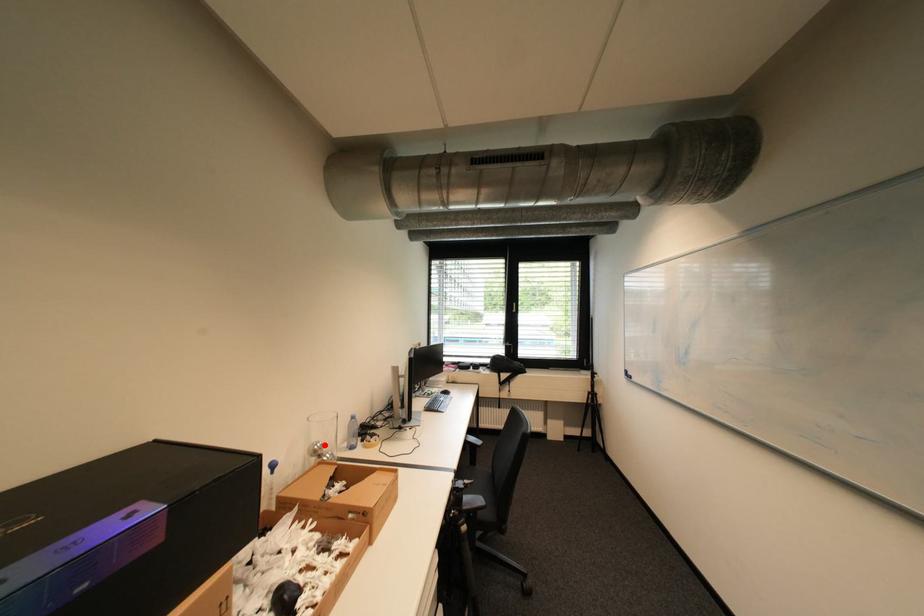
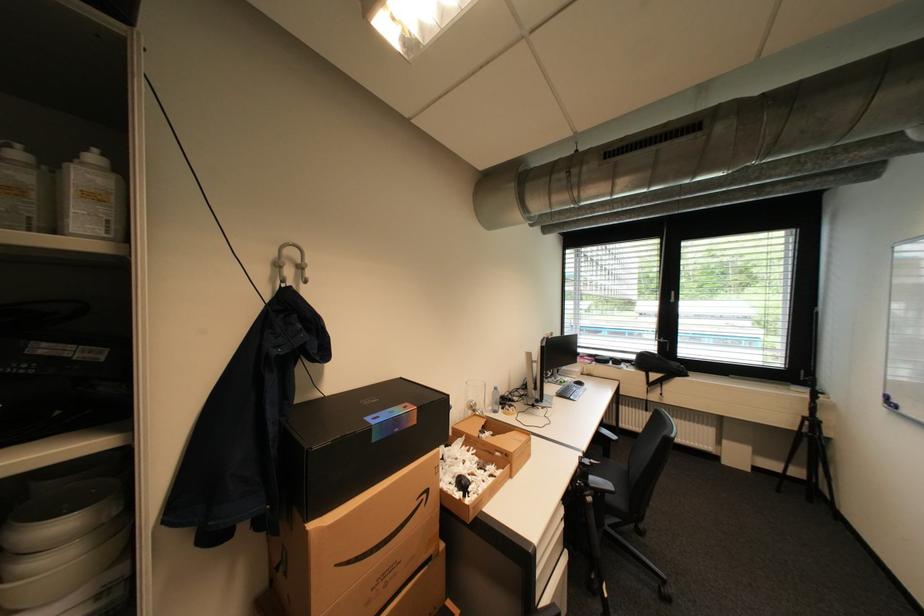
Locate, in the second image, the point that corresponds to the highlighted location in the first image.

(480, 402)